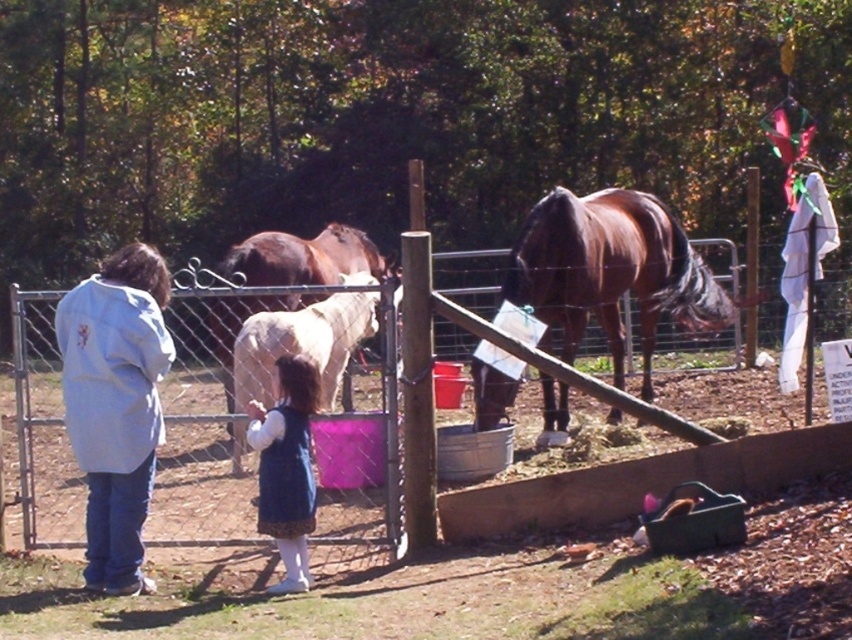
You are standing at the point where the adult is located. The brown glossy horse at center is represented by point (609, 272). Which direction should you walk to reach the horse?

The brown glossy horse at center is located at point (609, 272). Since you are at the adult location, you should walk towards the center of the enclosure to reach the horse.

You are a farmer who needs to fit both the brown glossy horse at center and the white cotton jacket at left into a trailer that can only accommodate items up to the size of the horse. Which item will definitely fit inside the trailer?

The white cotton jacket at left will definitely fit inside the trailer because its width is smaller than the brown glossy horse at center, which the trailer can accommodate.

You are standing at the entrance of the fenced enclosure and see the white cotton jacket at left and the white glossy horse at center. Which object is closer to the left side of the enclosure?

The white cotton jacket at left is closer to the left side of the enclosure because it is positioned to the left of the white glossy horse at center.